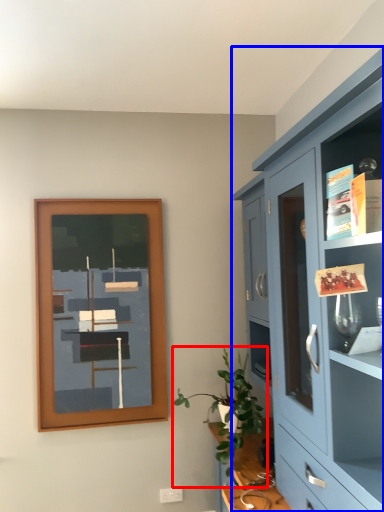
Question: Which object appears farthest to the camera in this image, houseplant (highlighted by a red box) or cabinetry (highlighted by a blue box)?

Choices:
 (A) houseplant
 (B) cabinetry

Answer: (A)